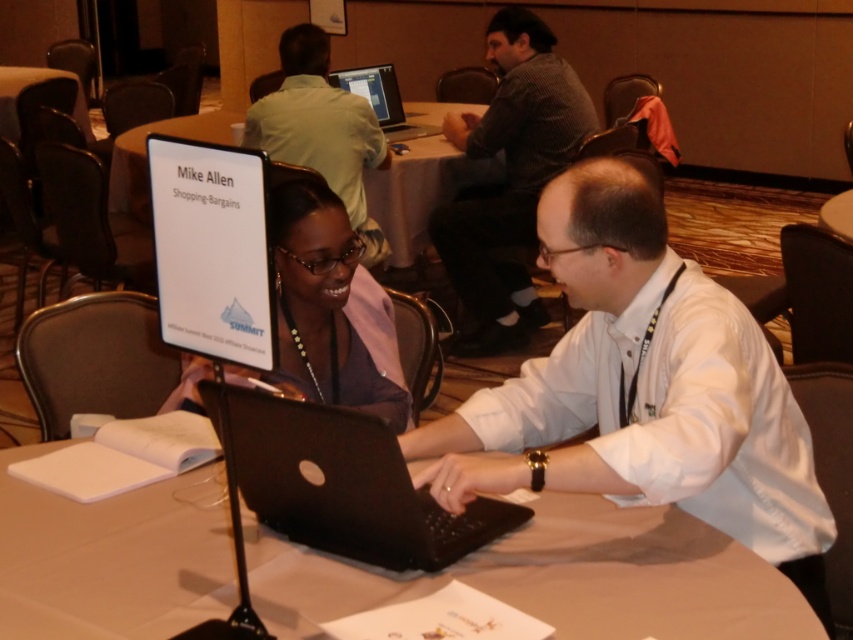
In the scene shown: Is gray checkered shirt at upper center bigger than matte purple shirt at center?

Yes, gray checkered shirt at upper center is bigger than matte purple shirt at center.

Find the location of `gray checkered shirt at upper center`. gray checkered shirt at upper center is located at coordinates (509, 177).

Locate an element on the screen. gray checkered shirt at upper center is located at coordinates (509, 177).

In the scene shown: Is black matte laptop at center taller than black glossy laptop at upper center?

No, black matte laptop at center is not taller than black glossy laptop at upper center.

Is black matte laptop at center bigger than black glossy laptop at upper center?

No.

Locate an element on the screen. Image resolution: width=853 pixels, height=640 pixels. black matte laptop at center is located at coordinates (343, 483).

Can you confirm if black plastic laptop at center is positioned to the right of gray checkered shirt at upper center?

In fact, black plastic laptop at center is to the left of gray checkered shirt at upper center.

Can you confirm if black plastic laptop at center is smaller than gray checkered shirt at upper center?

Yes, black plastic laptop at center is smaller than gray checkered shirt at upper center.

Does point (643, 572) come behind point (515, 332)?

That is False.

This screenshot has width=853, height=640. What are the coordinates of `black plastic laptop at center` in the screenshot? It's located at [x=560, y=577].